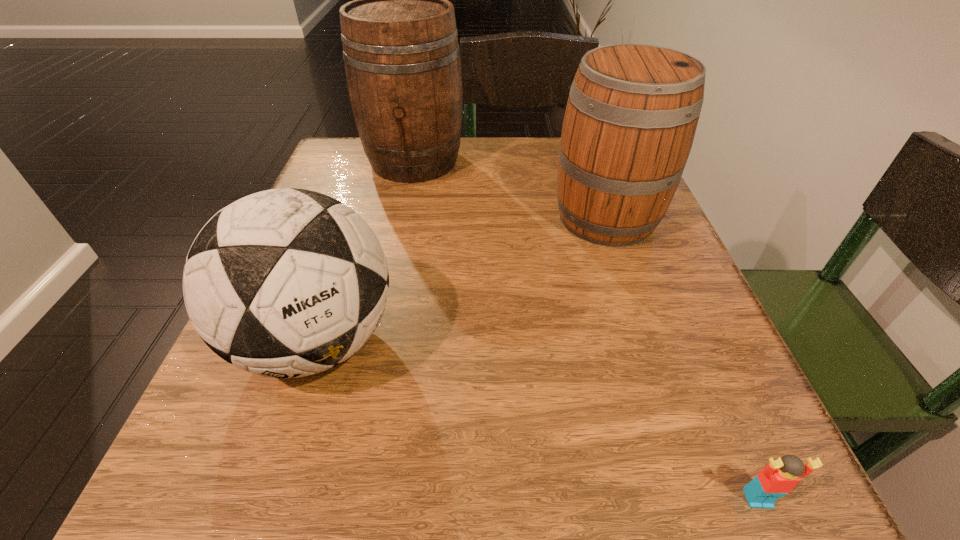
At what (x,y) coordinates should I click in order to perform the action: click on object that ranks as the third closest to the third tallest object. Please return your answer as a coordinate pair (x, y). This screenshot has width=960, height=540. Looking at the image, I should click on (778, 478).

Where is `vacant region that satisfies the following two spatial constraints: 1. on the side of the right cider near the bung hole; 2. on the right side of the left cider`? The width and height of the screenshot is (960, 540). vacant region that satisfies the following two spatial constraints: 1. on the side of the right cider near the bung hole; 2. on the right side of the left cider is located at coordinates [402, 218].

Where is `vacant area in the image that satisfies the following two spatial constraints: 1. on the side of the left cider near the bung hole; 2. on the left side of the right cider`? This screenshot has height=540, width=960. vacant area in the image that satisfies the following two spatial constraints: 1. on the side of the left cider near the bung hole; 2. on the left side of the right cider is located at coordinates (402, 218).